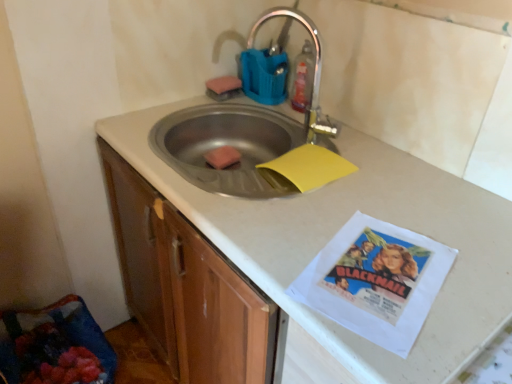
At what (x,y) coordinates should I click in order to perform the action: click on unoccupied region to the right of pink sponge at upper center, the 1th food viewed from the top. Please return your answer as a coordinate pair (x, y). This screenshot has width=512, height=384. Looking at the image, I should click on (265, 104).